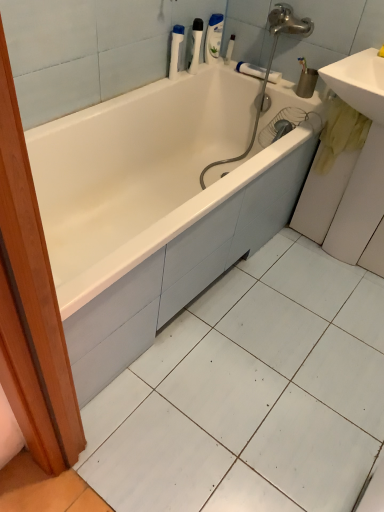
Question: Is point (372, 68) closer or farther from the camera than point (170, 60)?

Choices:
 (A) farther
 (B) closer

Answer: (B)

Question: From the image's perspective, is white glossy sink at right, which is counted as the second sink, starting from the top, positioned above or below white plastic bottle at upper center, acting as the 2th cleaning product starting from the right?

Choices:
 (A) below
 (B) above

Answer: (A)

Question: Estimate the real-world distances between objects in this image. Which object is closer to the translucent plastic bottle at upper center, marked as the 2th cleaning product in a left-to-right arrangement?

Choices:
 (A) white glossy bathtub at center
 (B) white glossy sink at right, which ranks as the 1th sink in bottom-to-top order
 (C) white plastic bottle at upper center, marked as the first toiletry in a right-to-left arrangement
 (D) translucent plastic toothbrush at upper center, which ranks as the 1th toiletry in left-to-right order
 (E) white glossy sink at upper right, which is counted as the first sink, starting from the top

Answer: (D)

Question: Estimate the real-world distances between objects in this image. Which object is closer to the white glossy sink at right, which ranks as the 1th sink in bottom-to-top order?

Choices:
 (A) white glossy bathtub at center
 (B) translucent plastic bottle at upper center, which ranks as the first cleaning product in back-to-front order
 (C) white glossy sink at upper right, which is counted as the first sink, starting from the top
 (D) translucent plastic toothbrush at upper center, which ranks as the 1th toiletry in left-to-right order
 (E) white plastic towel bar at upper center

Answer: (C)